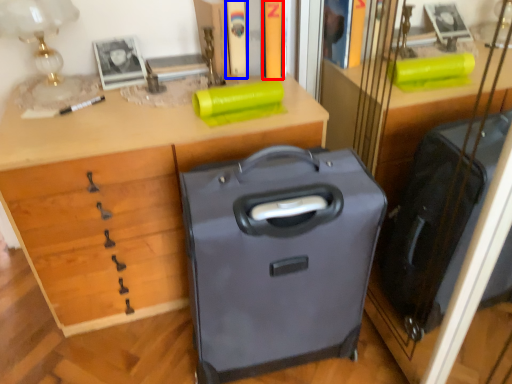
Question: Among these objects, which one is nearest to the camera, book (highlighted by a red box) or book (highlighted by a blue box)?

Choices:
 (A) book
 (B) book

Answer: (A)